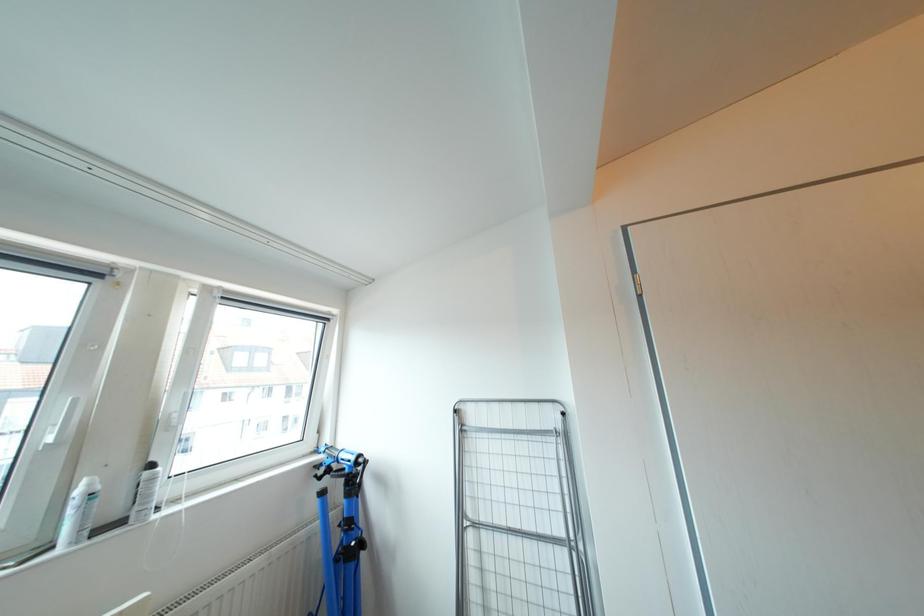
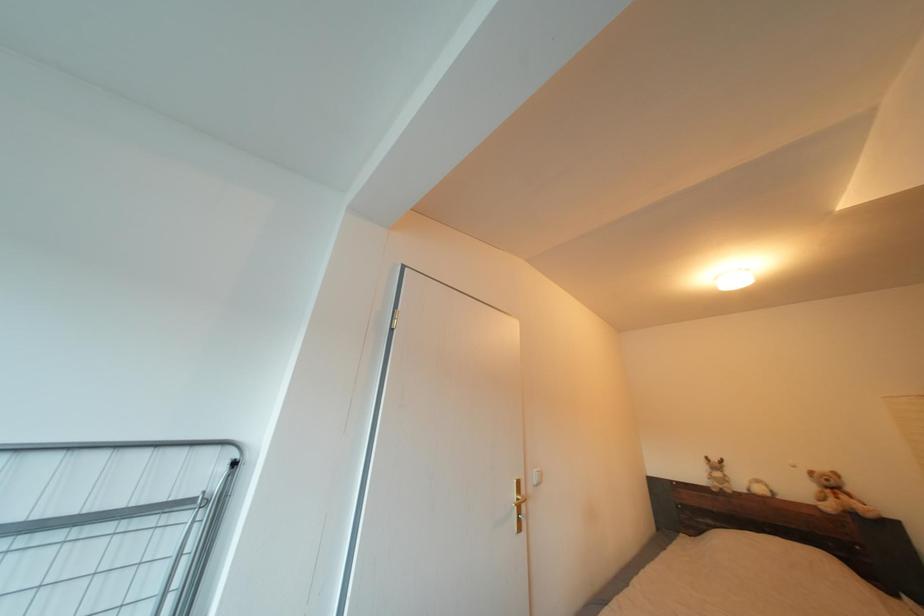
The images are taken continuously from a first-person perspective. In which direction is your viewpoint rotating?

The camera rotated toward right-up.